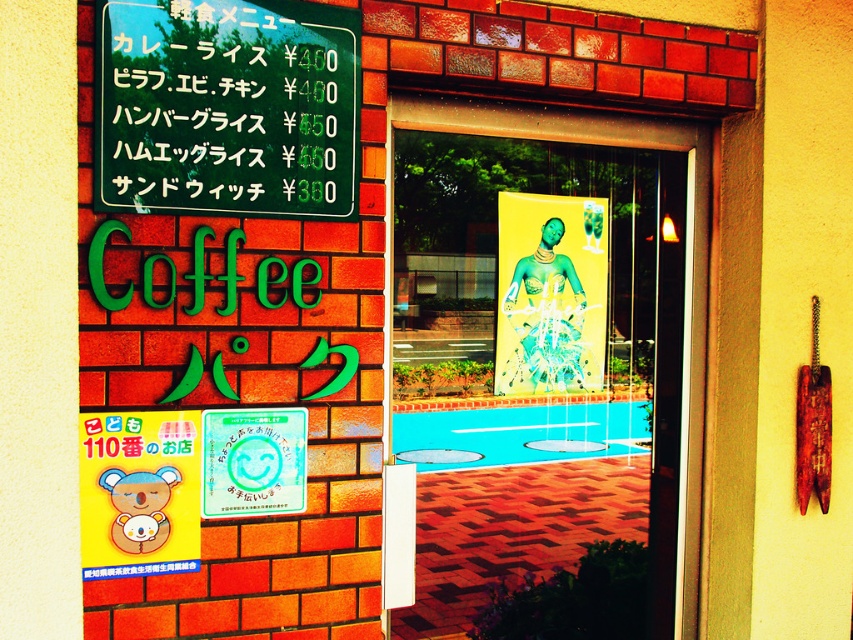
Which is above, yellow paper bear at upper left or white glossy signboard at upper center?

white glossy signboard at upper center is higher up.

Which is in front, point (164, 518) or point (299, 410)?

Point (164, 518) is in front.

Find the location of a particular element. yellow paper bear at upper left is located at coordinates (138, 493).

In the scene shown: Does translucent glass window at center come in front of green plastic menu board at upper left?

No, it is not.

Is translucent glass window at center above green plastic menu board at upper left?

Yes.

Image resolution: width=853 pixels, height=640 pixels. Describe the element at coordinates (546, 324) in the screenshot. I see `translucent glass window at center` at that location.

Where is `translucent glass window at center`? The width and height of the screenshot is (853, 640). translucent glass window at center is located at coordinates (546, 324).

Is point (567, 278) closer to viewer compared to point (178, 540)?

No, (567, 278) is further to viewer.

Does translucent glass window at center have a larger size compared to yellow paper bear at upper left?

Correct, translucent glass window at center is larger in size than yellow paper bear at upper left.

Describe the element at coordinates (546, 324) in the screenshot. I see `translucent glass window at center` at that location.

I want to click on translucent glass window at center, so click(x=546, y=324).